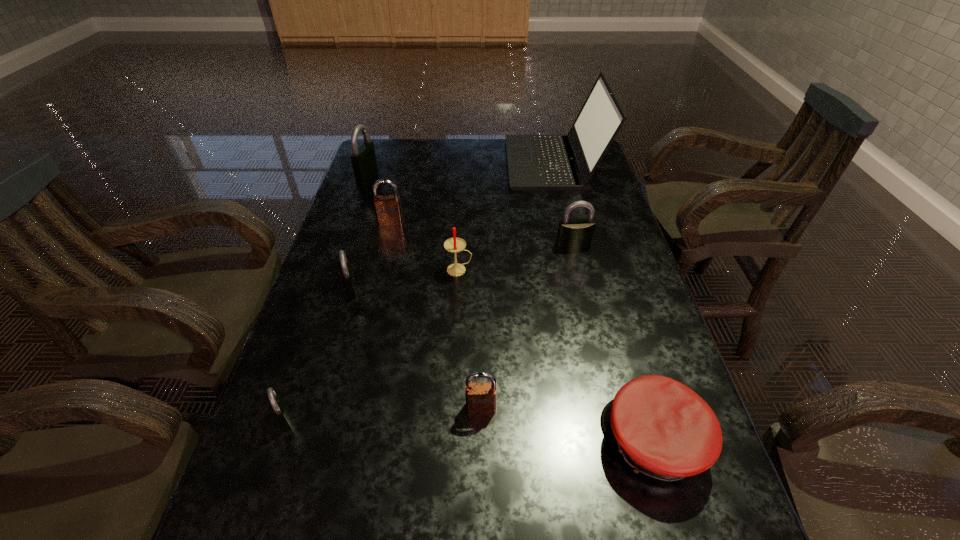
Locate an element on the screen. This screenshot has height=540, width=960. vacant space in between the candle and the second padlock from right to left is located at coordinates (470, 339).

At what (x,y) coordinates should I click in order to perform the action: click on free space between the red cap and the rightmost padlock. Please return your answer as a coordinate pair (x, y). Image resolution: width=960 pixels, height=540 pixels. Looking at the image, I should click on (613, 343).

Find the location of `vacant region between the fourth farthest padlock and the biggest black padlock`. vacant region between the fourth farthest padlock and the biggest black padlock is located at coordinates (359, 232).

The image size is (960, 540). I want to click on vacant area between the second smallest black padlock and the farther brown padlock, so click(371, 256).

Locate an element on the screen. empty space that is in between the third smallest black padlock and the candle is located at coordinates (516, 258).

Where is `free space that is in between the farther brown padlock and the right brown padlock`? free space that is in between the farther brown padlock and the right brown padlock is located at coordinates (436, 315).

I want to click on free area in between the second padlock from right to left and the laptop, so click(517, 285).

At what (x,y) coordinates should I click in order to perform the action: click on free space that is in between the farthest black padlock and the gray laptop. Please return your answer as a coordinate pair (x, y). This screenshot has height=540, width=960. Looking at the image, I should click on (460, 169).

Identify the location of object that stands as the seventh closest to the shortest padlock. (364, 162).

Image resolution: width=960 pixels, height=540 pixels. In order to click on object that stands as the fifth closest to the tallest object in this screenshot , I will do `click(346, 271)`.